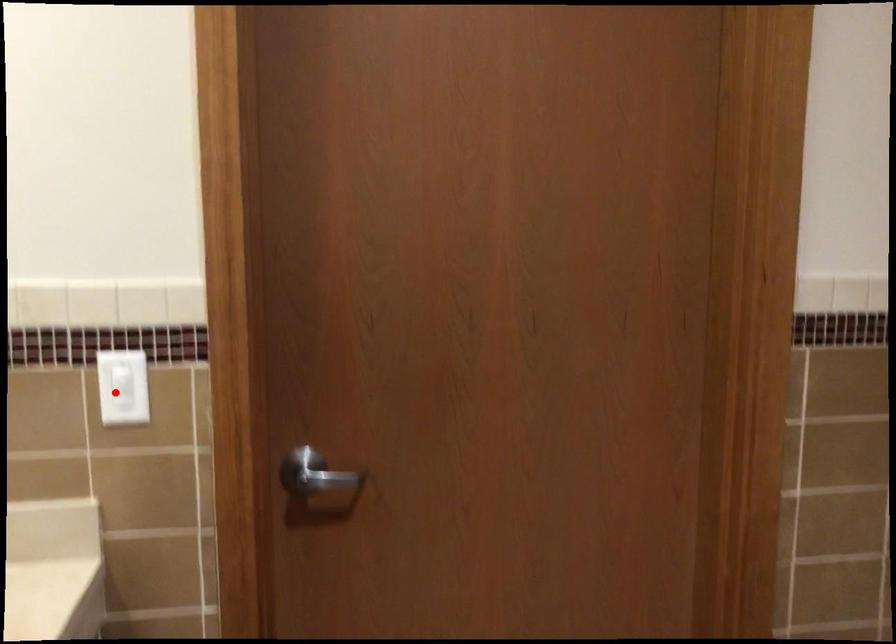
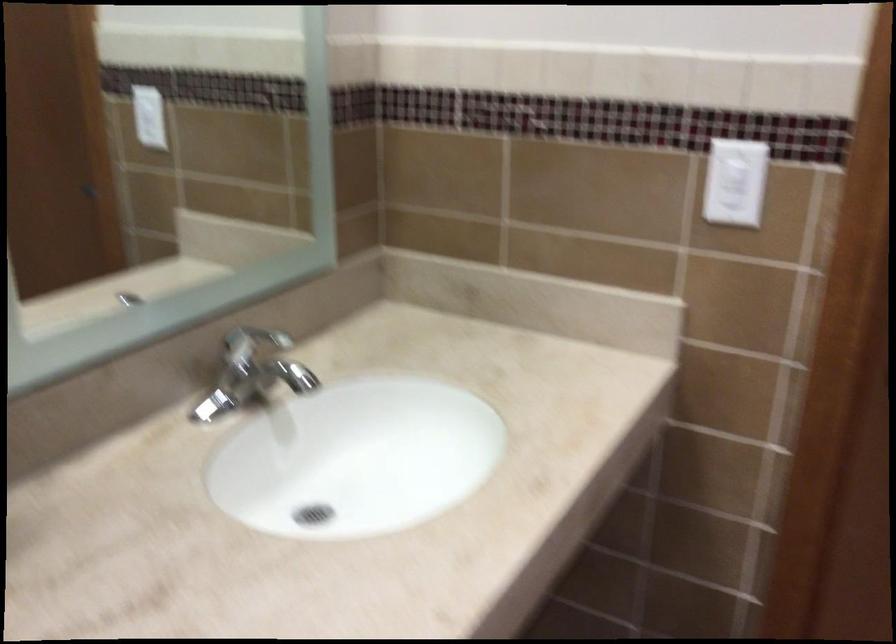
The point at the highlighted location is marked in the first image. Where is the corresponding point in the second image?

(736, 182)